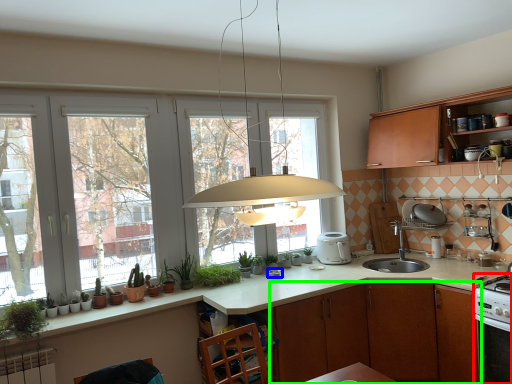
Question: Which object is positioned farthest from kitchen appliance (highlighted by a red box)? Select from appliance (highlighted by a blue box) and cabinetry (highlighted by a green box).

Choices:
 (A) appliance
 (B) cabinetry

Answer: (A)